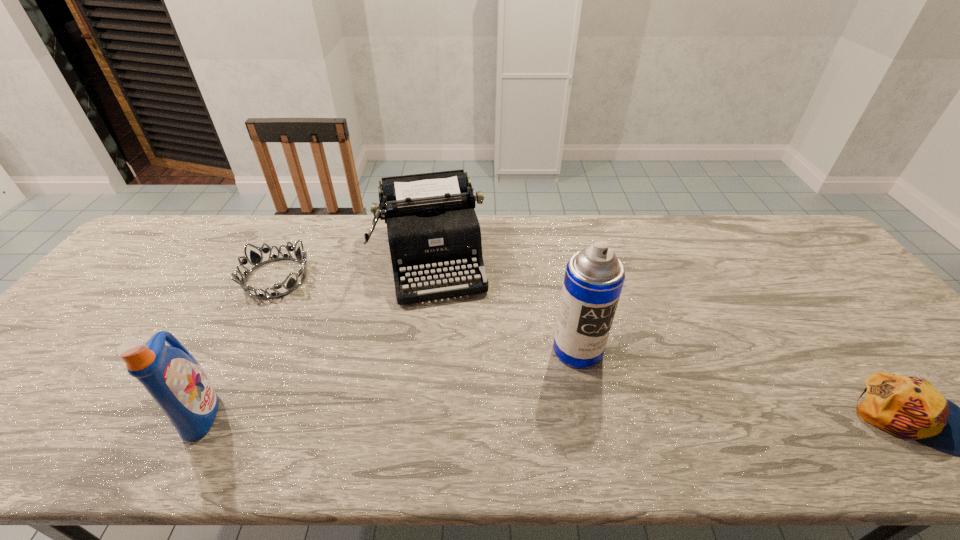
Identify which object is the second closest to the second tallest object. Please provide its 2D coordinates. Your answer should be formatted as a tuple, i.e. [(x, y)], where the tuple contains the x and y coordinates of a point satisfying the conditions above.

[(433, 231)]

Locate an element on the screen. The width and height of the screenshot is (960, 540). free space that satisfies the following two spatial constraints: 1. on the front side of the tallest object; 2. on the left side of the shortest object is located at coordinates (239, 350).

I want to click on blank area in the image that satisfies the following two spatial constraints: 1. on the front side of the tallest object; 2. on the right side of the shortest object, so click(x=239, y=350).